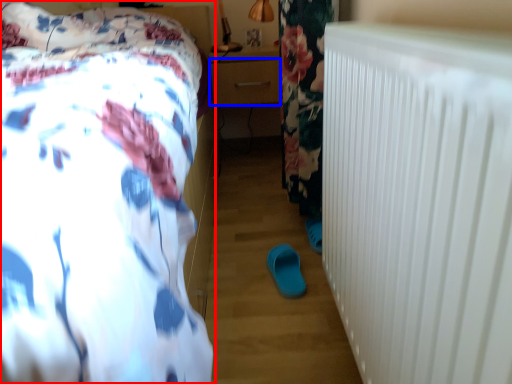
Question: Which of the following is the closest to the observer, bed (highlighted by a red box) or drawer (highlighted by a blue box)?

Choices:
 (A) bed
 (B) drawer

Answer: (A)